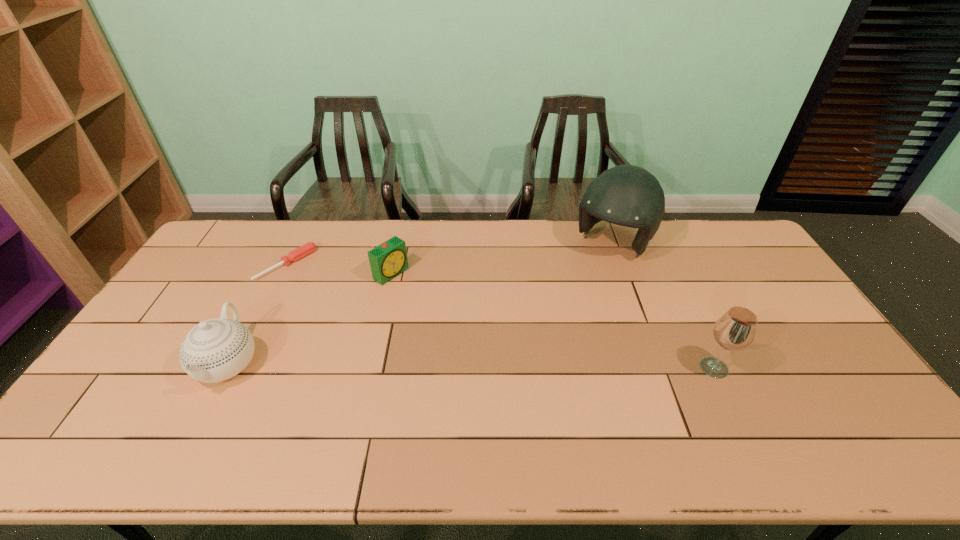
What are the coordinates of `free space at the far left corner of the desktop` in the screenshot? It's located at (230, 228).

Where is `free space at the far right corner`? free space at the far right corner is located at coordinates (744, 249).

Where is `free space at the near right corner`? free space at the near right corner is located at coordinates [x=869, y=421].

You are a GUI agent. You are given a task and a screenshot of the screen. Output one action in this format:
    pyautogui.click(x=<x>, y=<y>)
    Task: Click on the free space that is in between the wineglass and the shortest object
    This screenshot has height=540, width=960.
    Given the screenshot: What is the action you would take?
    pyautogui.click(x=500, y=316)

Image resolution: width=960 pixels, height=540 pixels. What are the coordinates of `free point between the chinaware and the wineglass` in the screenshot? It's located at (471, 366).

Find the location of a particular element. The image size is (960, 540). vacant space that's between the tallest object and the second tallest object is located at coordinates (663, 306).

Locate an element on the screen. This screenshot has width=960, height=540. empty location between the third object from right to left and the wineglass is located at coordinates (552, 321).

Identify the location of free area in between the wineglass and the tallest object. (663, 306).

Find the location of a particular element. This screenshot has width=960, height=540. vacant area between the third shortest object and the tallest object is located at coordinates (420, 303).

Where is `free point between the third object from right to left and the wineglass`? free point between the third object from right to left and the wineglass is located at coordinates (552, 321).